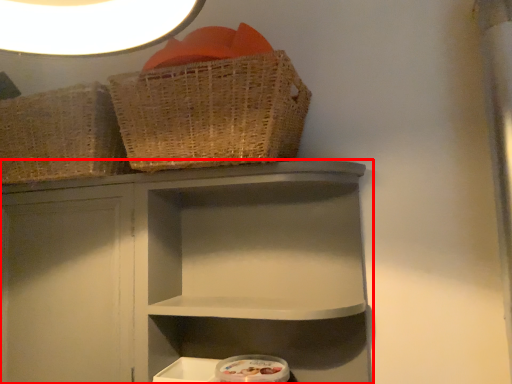
Question: From the image's perspective, what is the correct spatial relationship of shelf (annotated by the red box) in relation to basket?

Choices:
 (A) below
 (B) above

Answer: (A)